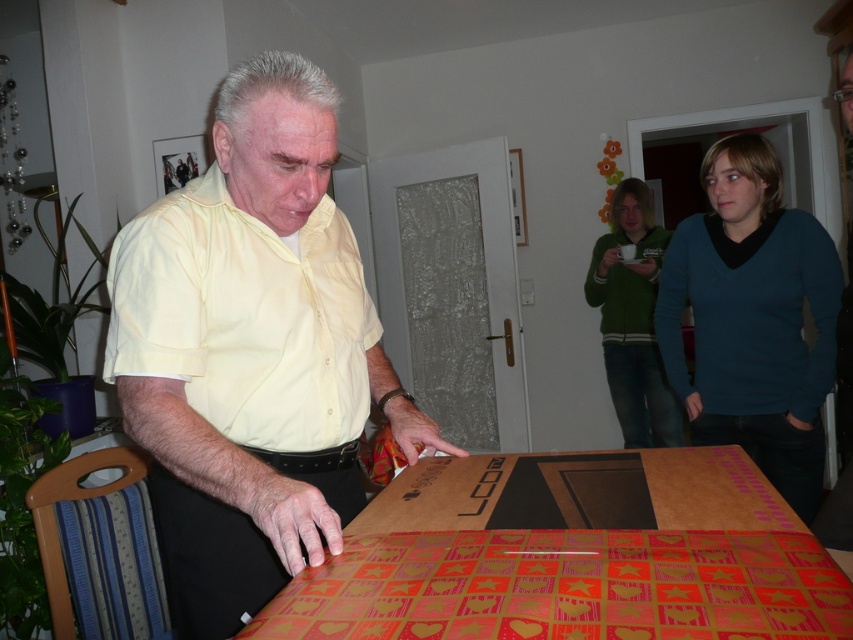
In the scene shown: Who is more forward, (224, 333) or (241, 337)?

Point (241, 337) is in front.

Can you confirm if yellow matte shirt at center is positioned to the right of yellow cotton shirt at center?

Correct, you'll find yellow matte shirt at center to the right of yellow cotton shirt at center.

Who is more distant from viewer, (241, 544) or (363, 305)?

The point (363, 305) is more distant.

Image resolution: width=853 pixels, height=640 pixels. Find the location of `yellow matte shirt at center`. yellow matte shirt at center is located at coordinates (251, 353).

Between yellow matte shirt at center and cardboard wrapping paper at lower center, which one is positioned lower?

cardboard wrapping paper at lower center

Locate an element on the screen. This screenshot has width=853, height=640. yellow matte shirt at center is located at coordinates (251, 353).

Does yellow cotton shirt at center appear on the left side of green fleece jacket at upper center?

Indeed, yellow cotton shirt at center is positioned on the left side of green fleece jacket at upper center.

Is yellow cotton shirt at center above green fleece jacket at upper center?

No, yellow cotton shirt at center is not above green fleece jacket at upper center.

This screenshot has height=640, width=853. I want to click on yellow cotton shirt at center, so click(245, 316).